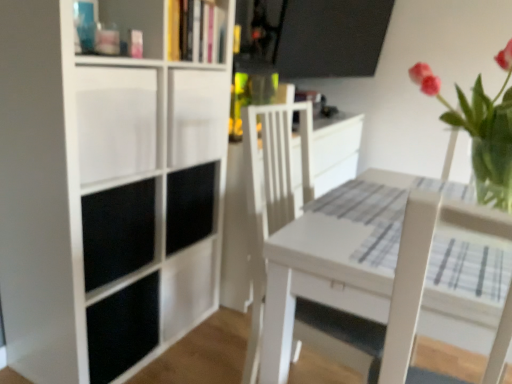
Question: From the image's perspective, is white wood swivel chair at center located beneath black matte cabinet at center, the 1th cabinet from the back?

Choices:
 (A) no
 (B) yes

Answer: (B)

Question: Considering the relative positions of white wood swivel chair at center and black matte cabinet at center, which is the 2th cabinet from front to back, in the image provided, is white wood swivel chair at center behind black matte cabinet at center, which is the 2th cabinet from front to back,?

Choices:
 (A) no
 (B) yes

Answer: (A)

Question: Is white wood swivel chair at center bigger than black matte cabinet at center, which is the 2th cabinet from front to back?

Choices:
 (A) no
 (B) yes

Answer: (B)

Question: Is white wood swivel chair at center located outside black matte cabinet at center, which is the 2th cabinet from front to back?

Choices:
 (A) no
 (B) yes

Answer: (B)

Question: Is white wood swivel chair at center looking in the opposite direction of black matte cabinet at center, the 1th cabinet from the back?

Choices:
 (A) yes
 (B) no

Answer: (A)

Question: Does white wood swivel chair at center have a greater width compared to black matte cabinet at center, the 1th cabinet from the back?

Choices:
 (A) no
 (B) yes

Answer: (B)

Question: Considering the relative sizes of pink glass vase at upper right and black matte cabinet at center, the 1th cabinet from the back, in the image provided, is pink glass vase at upper right wider than black matte cabinet at center, the 1th cabinet from the back,?

Choices:
 (A) yes
 (B) no

Answer: (A)

Question: Is pink glass vase at upper right located outside black matte cabinet at center, the 1th cabinet from the back?

Choices:
 (A) yes
 (B) no

Answer: (A)

Question: Are pink glass vase at upper right and black matte cabinet at center, which is the 2th cabinet from front to back, located far from each other?

Choices:
 (A) yes
 (B) no

Answer: (B)

Question: From a real-world perspective, does pink glass vase at upper right sit lower than black matte cabinet at center, which is the 2th cabinet from front to back?

Choices:
 (A) no
 (B) yes

Answer: (A)

Question: Can you confirm if pink glass vase at upper right is taller than black matte cabinet at center, which is the 2th cabinet from front to back?

Choices:
 (A) no
 (B) yes

Answer: (B)

Question: Would you say pink glass vase at upper right contains black matte cabinet at center, the 1th cabinet from the back?

Choices:
 (A) yes
 (B) no

Answer: (B)

Question: Is white matte cabinet at left, the second cabinet when ordered from back to front, located outside white matte bookcase at left?

Choices:
 (A) yes
 (B) no

Answer: (B)